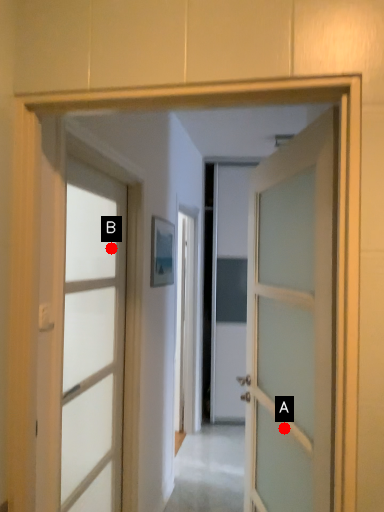
Question: Two points are circled on the image, labeled by A and B beside each circle. Which point is farther to the camera?

Choices:
 (A) A is further
 (B) B is further

Answer: (B)